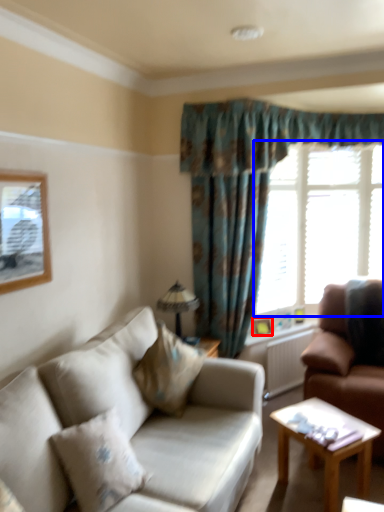
Question: Which point is further to the camera, picture frame (highlighted by a red box) or window (highlighted by a blue box)?

Choices:
 (A) picture frame
 (B) window

Answer: (B)